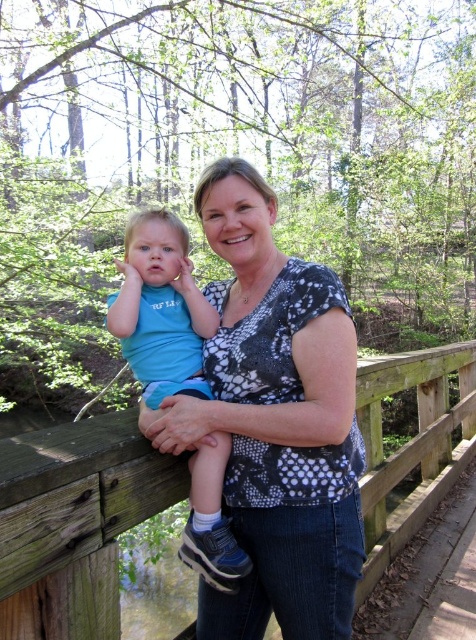
Question: Which is nearer to the wooden bridge at center?

Choices:
 (A) patterned fabric shirt at center
 (B) matte blue shirt at left

Answer: (A)

Question: Estimate the real-world distances between objects in this image. Which object is closer to the matte blue shirt at left?

Choices:
 (A) wooden bridge at center
 (B) patterned fabric shirt at center

Answer: (B)

Question: Which point is closer to the camera?

Choices:
 (A) coord(116,637)
 (B) coord(156,227)
 (C) coord(257,186)

Answer: (A)

Question: Observing the image, what is the correct spatial positioning of patterned fabric shirt at center in reference to wooden bridge at center?

Choices:
 (A) left
 (B) right

Answer: (A)

Question: Is wooden bridge at center thinner than matte blue shirt at left?

Choices:
 (A) yes
 (B) no

Answer: (B)

Question: Can you confirm if wooden bridge at center is positioned above matte blue shirt at left?

Choices:
 (A) no
 (B) yes

Answer: (A)